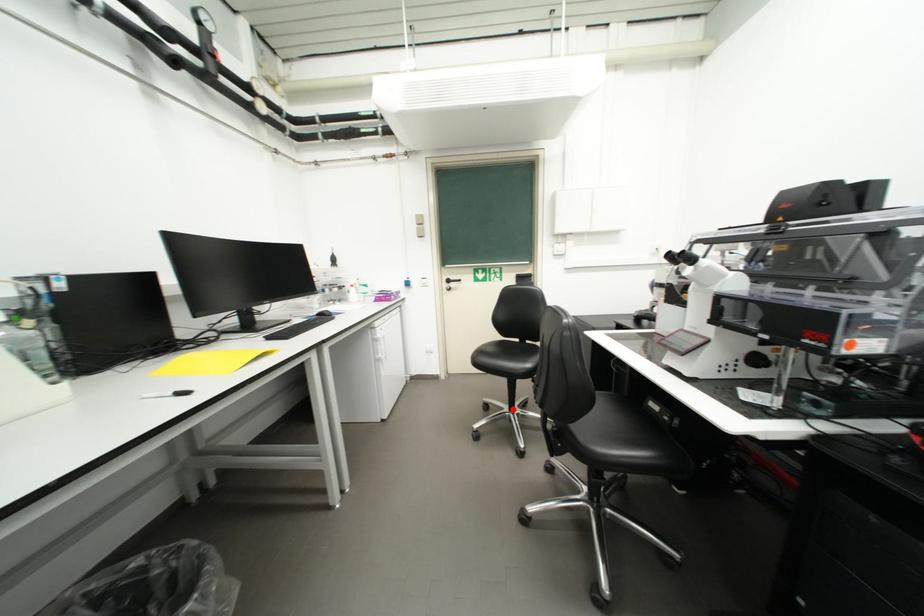
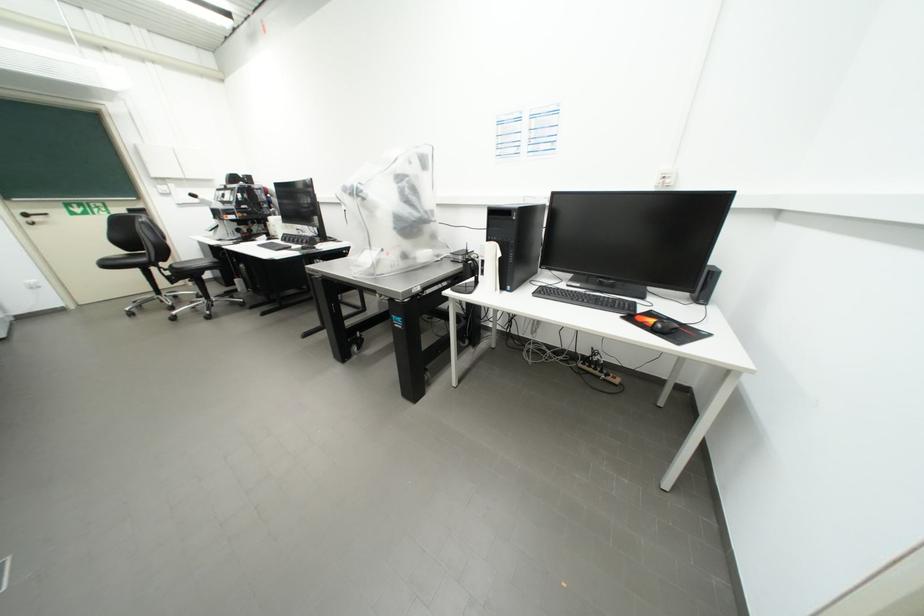
Locate, in the second image, the point that corresponds to the highlighted location in the first image.

(160, 296)